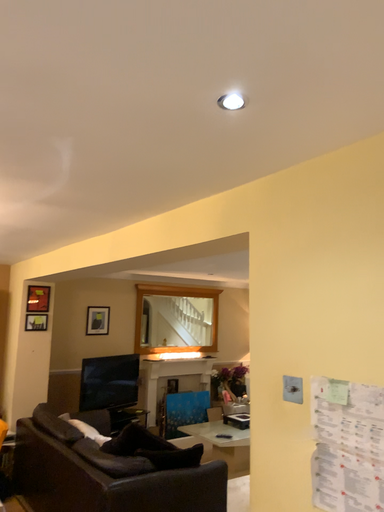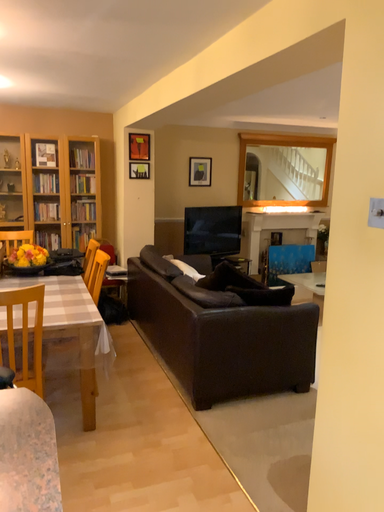
Question: Which way did the camera rotate in the video?

Choices:
 (A) rotated downward
 (B) rotated upward

Answer: (A)